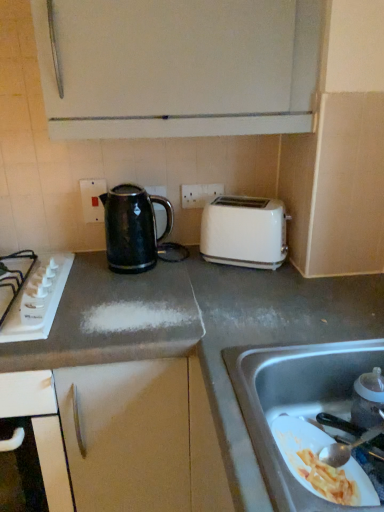
Question: Relative to white plastic electric outlet at center, the 2th electric outlet positioned from the left, is white glossy toaster at upper right in front or behind?

Choices:
 (A) front
 (B) behind

Answer: (A)

Question: Is white glossy toaster at upper right wider or thinner than white plastic electric outlet at center, which is the 1th electric outlet from right to left?

Choices:
 (A) wide
 (B) thin

Answer: (A)

Question: Estimate the real-world distances between objects in this image. Which object is farther from the white glossy toaster at upper right?

Choices:
 (A) white plastic electric outlet at center, the 2th electric outlet positioned from the left
 (B) white plastic gas stove at left
 (C) black glossy kettle at center
 (D) transparent plastic baby bottle at lower right
 (E) matte plastic electrical outlet at upper center, arranged as the 1th electric outlet when viewed from the left

Answer: (D)

Question: Considering the real-world distances, which object is farthest from the white plastic gas stove at left?

Choices:
 (A) matte black kettle at center
 (B) white glossy toaster at upper right
 (C) transparent plastic baby bottle at lower right
 (D) stainless steel sink at lower right
 (E) white plastic electric outlet at center, which is the 1th electric outlet from right to left

Answer: (C)